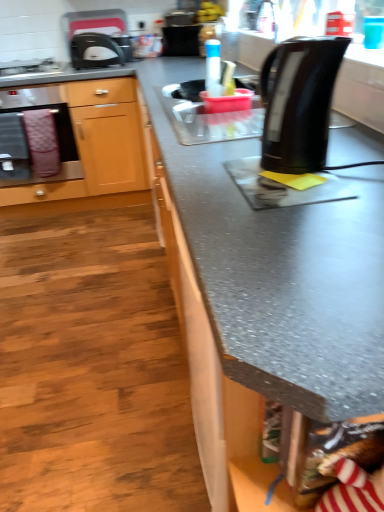
Question: Can you confirm if stainless steel oven at left is bigger than pink fabric towel at left?

Choices:
 (A) no
 (B) yes

Answer: (B)

Question: Is stainless steel oven at left facing away from pink fabric towel at left?

Choices:
 (A) no
 (B) yes

Answer: (A)

Question: From a real-world perspective, is stainless steel oven at left positioned over pink fabric towel at left based on gravity?

Choices:
 (A) yes
 (B) no

Answer: (A)

Question: Is stainless steel oven at left outside pink fabric towel at left?

Choices:
 (A) no
 (B) yes

Answer: (B)

Question: Does stainless steel oven at left appear on the left side of pink fabric towel at left?

Choices:
 (A) no
 (B) yes

Answer: (B)

Question: Is stainless steel oven at left not close to pink fabric towel at left?

Choices:
 (A) no
 (B) yes

Answer: (A)

Question: Is transparent plastic bottle at center at the left side of pink fabric towel at left?

Choices:
 (A) no
 (B) yes

Answer: (A)

Question: From a real-world perspective, is transparent plastic bottle at center positioned over pink fabric towel at left based on gravity?

Choices:
 (A) yes
 (B) no

Answer: (A)

Question: Is transparent plastic bottle at center further to the viewer compared to pink fabric towel at left?

Choices:
 (A) yes
 (B) no

Answer: (B)

Question: Considering the relative positions of transparent plastic bottle at center and pink fabric towel at left in the image provided, is transparent plastic bottle at center in front of pink fabric towel at left?

Choices:
 (A) no
 (B) yes

Answer: (B)

Question: Is transparent plastic bottle at center shorter than pink fabric towel at left?

Choices:
 (A) yes
 (B) no

Answer: (A)

Question: Is transparent plastic bottle at center turned away from pink fabric towel at left?

Choices:
 (A) yes
 (B) no

Answer: (B)

Question: From a real-world perspective, is wooden cabinet at left positioned under matte black toaster at upper left based on gravity?

Choices:
 (A) no
 (B) yes

Answer: (B)